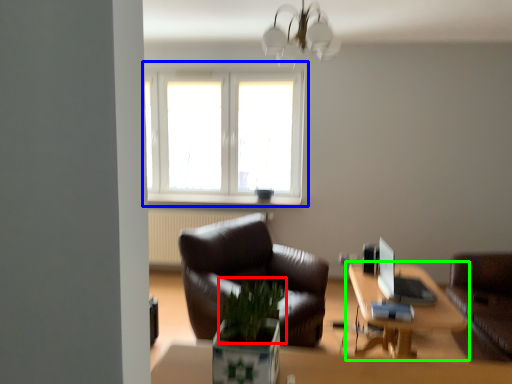
Question: Based on their relative distances, which object is farther from plant (highlighted by a red box)? Choose from window (highlighted by a blue box) and table (highlighted by a green box).

Choices:
 (A) window
 (B) table

Answer: (A)